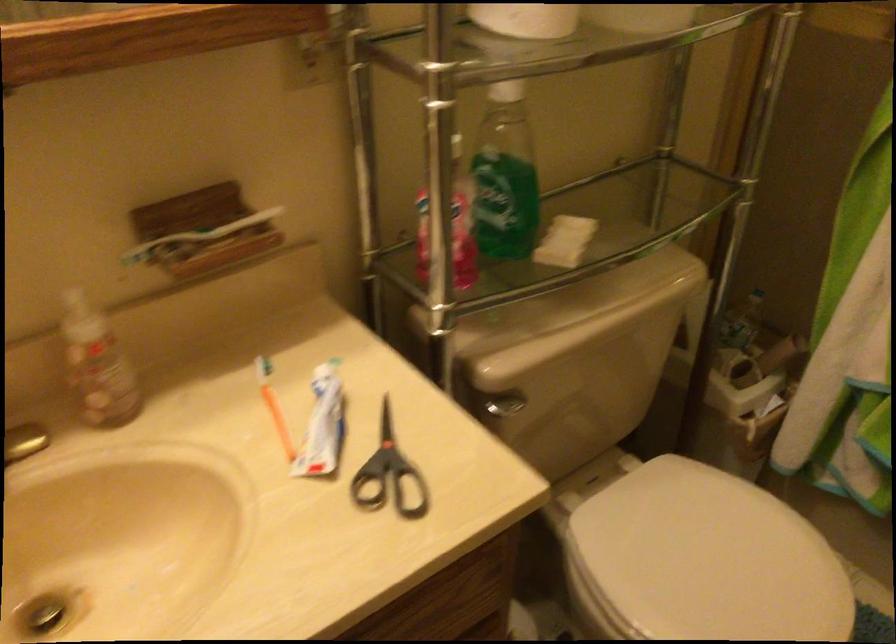
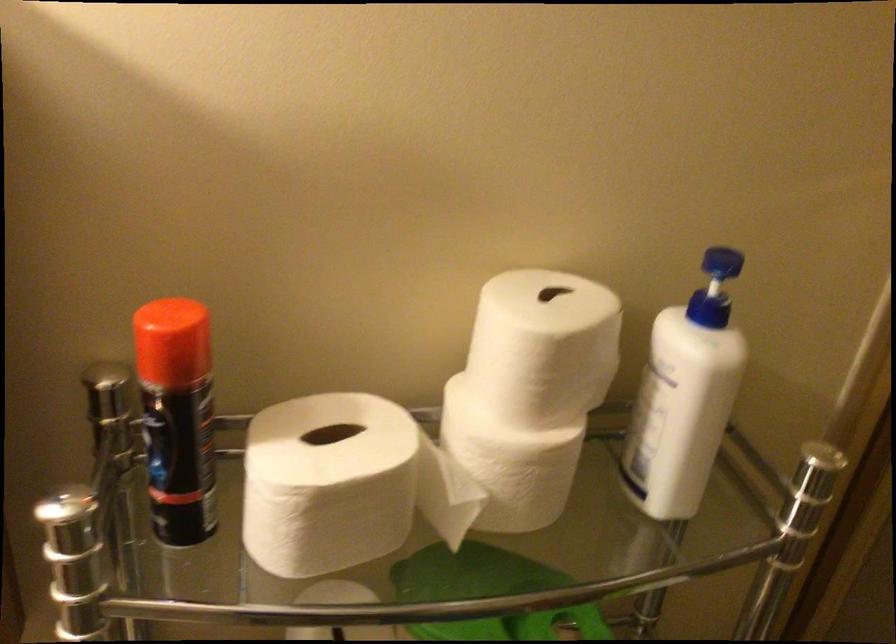
The images are taken continuously from a first-person perspective. In which direction are you moving?

The movement direction of the cameraman is right, forward.